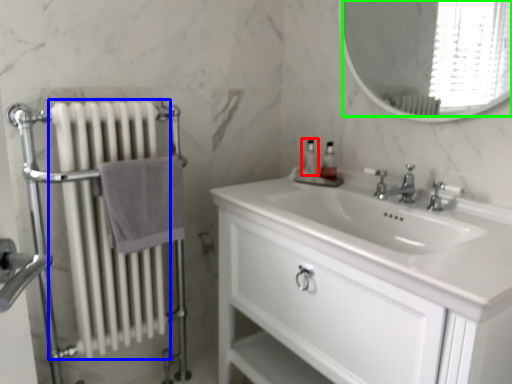
Question: Which is nearer to the soap dispenser (highlighted by a red box)? radiator (highlighted by a blue box) or mirror (highlighted by a green box).

Choices:
 (A) radiator
 (B) mirror

Answer: (A)